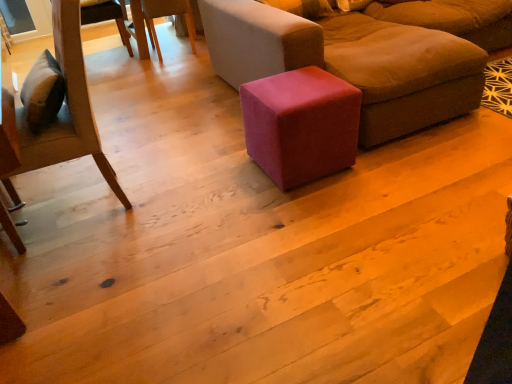
Where is `vacant space behind wooden chair at left, which is the first chair from bottom to top`? The image size is (512, 384). vacant space behind wooden chair at left, which is the first chair from bottom to top is located at coordinates (132, 145).